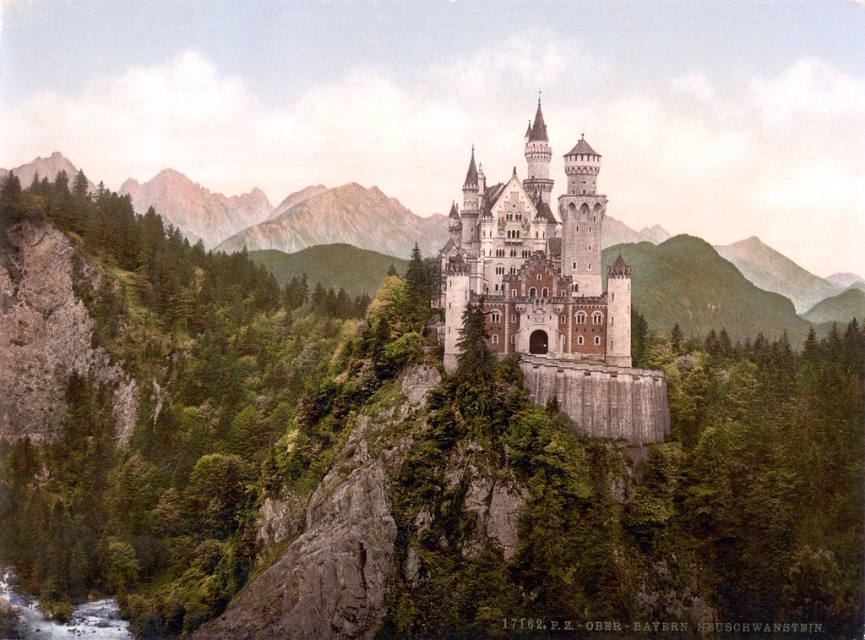
In the scene shown: You are a hiker standing at the base of the green rocky cliff at left and want to reach the white stone castle at center. Which direction should you move to get there?

The green rocky cliff at left is positioned under the white stone castle at center, so you should move upward towards the white stone castle at center.